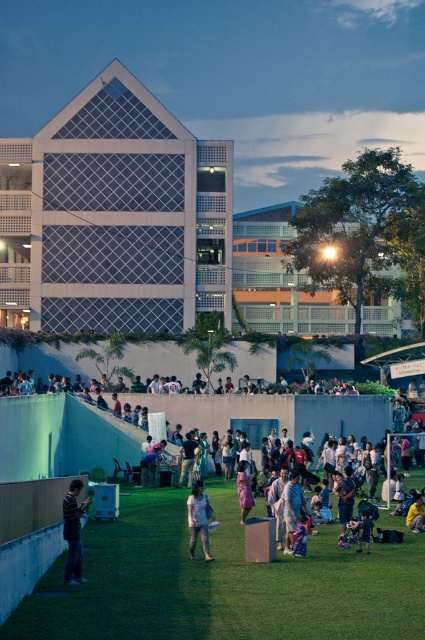
Question: Which point is closer to the camera taking this photo?

Choices:
 (A) (209, 506)
 (B) (70, 522)
 (C) (285, 493)
 (D) (249, 488)

Answer: (B)

Question: Estimate the real-world distances between objects in this image. Which object is farther from the light blue fabric at center?

Choices:
 (A) light brown fabric dress at center
 (B) denim shorts at center

Answer: (B)

Question: Does light brown fabric dress at center appear on the left side of denim shorts at center?

Choices:
 (A) yes
 (B) no

Answer: (A)

Question: Which point appears farthest from the camera in this image?

Choices:
 (A) (74, 564)
 (B) (289, 538)
 (C) (201, 481)
 (D) (249, 476)

Answer: (C)

Question: Does light blue fabric at center come in front of denim shorts at center?

Choices:
 (A) yes
 (B) no

Answer: (A)

Question: Is the position of light blue fabric at center more distant than that of striped cotton shirt at lower left?

Choices:
 (A) yes
 (B) no

Answer: (B)